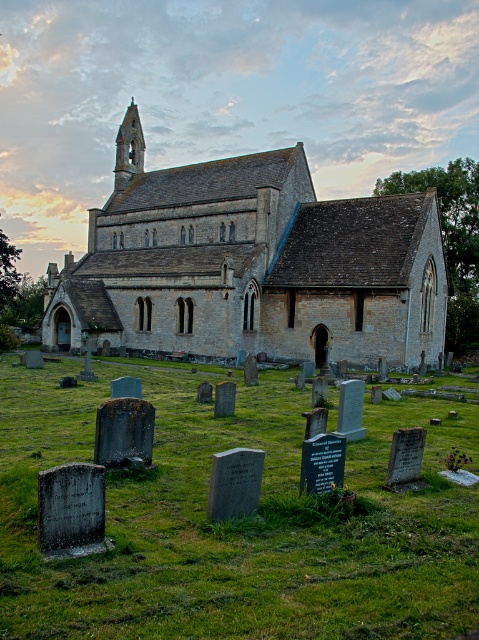
Question: Is green mossy grass at lower center positioned at the back of stone church at center?

Choices:
 (A) yes
 (B) no

Answer: (B)

Question: Is stone church at center bigger than smooth stone spire at upper left?

Choices:
 (A) no
 (B) yes

Answer: (B)

Question: Which object is the closest to the green mossy grass at lower center?

Choices:
 (A) stone church at center
 (B) smooth stone spire at upper left

Answer: (A)

Question: Estimate the real-world distances between objects in this image. Which object is closer to the smooth stone spire at upper left?

Choices:
 (A) green mossy grass at lower center
 (B) stone church at center

Answer: (B)

Question: Among these points, which one is nearest to the camera?

Choices:
 (A) (121, 164)
 (B) (13, 432)

Answer: (B)

Question: Is stone church at center positioned before smooth stone spire at upper left?

Choices:
 (A) no
 (B) yes

Answer: (B)